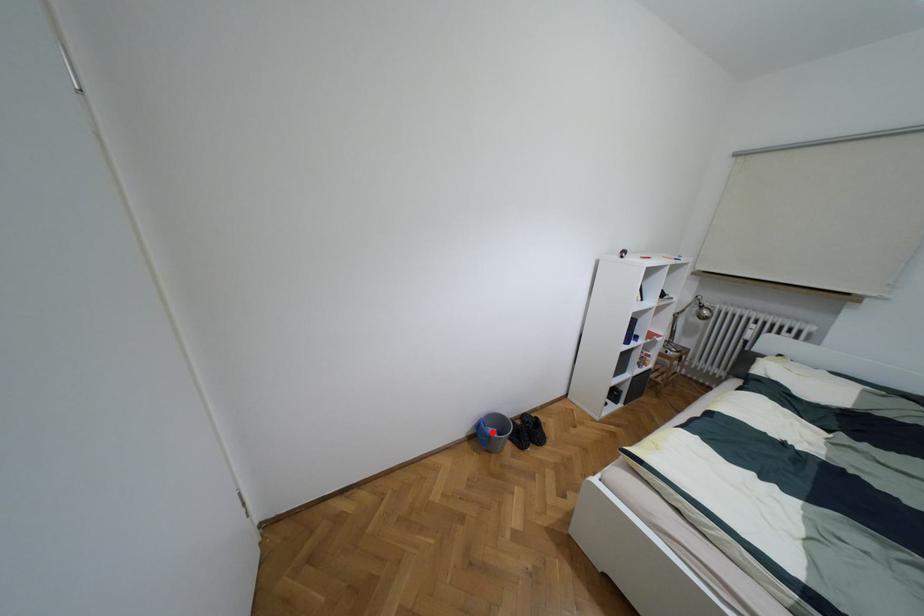
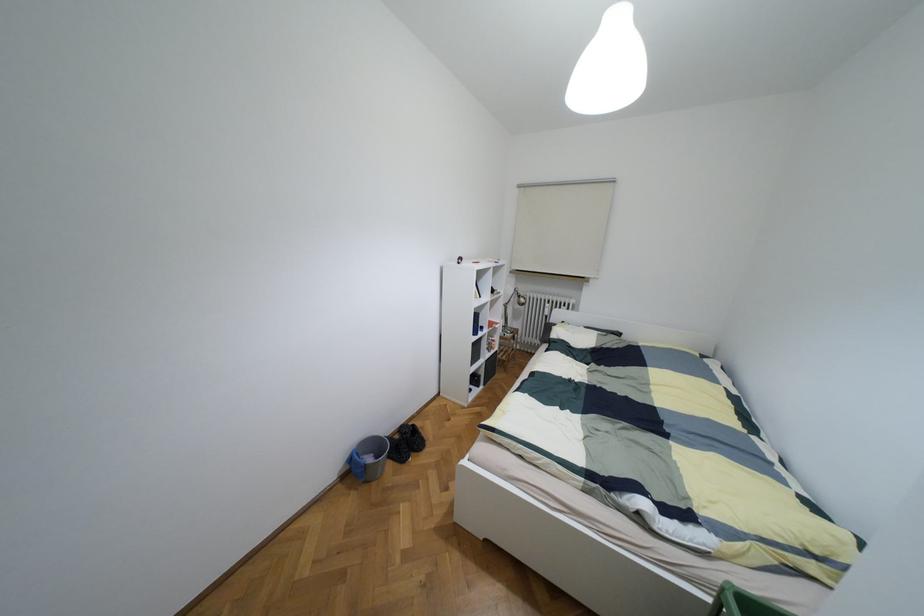
Question: I am providing you with two images of the same scene from different viewpoints. In image1, a red point is highlighted. Considering the same 3D point in image2, which of the following is correct?

Choices:
 (A) It is closer
 (B) It is farther

Answer: (A)